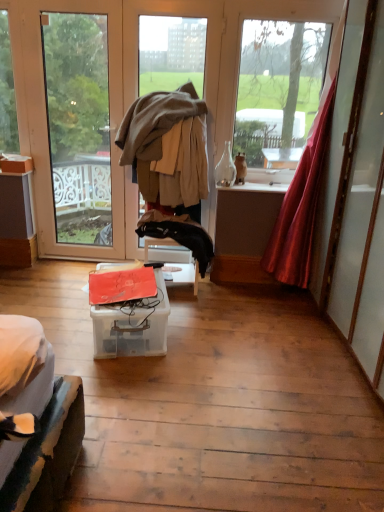
The height and width of the screenshot is (512, 384). I want to click on free location in front of matte brown vase at upper center, so click(245, 188).